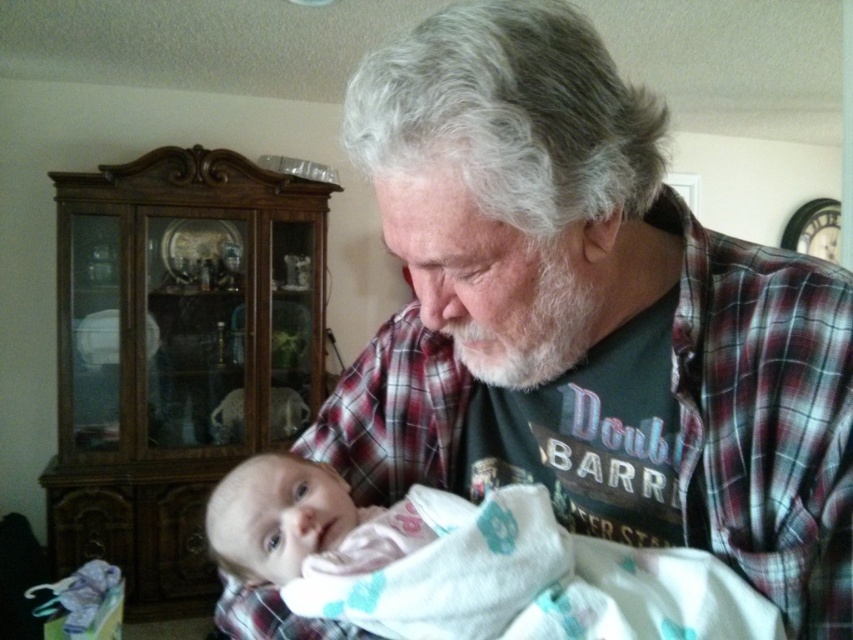
Question: Considering the relative positions of plaid flannel shirt at center and white soft swaddling blanket at center in the image provided, where is plaid flannel shirt at center located with respect to white soft swaddling blanket at center?

Choices:
 (A) left
 (B) right

Answer: (B)

Question: Which of the following is the closest to the observer?

Choices:
 (A) (498, 552)
 (B) (428, 323)

Answer: (A)

Question: Where is plaid flannel shirt at center located in relation to white soft swaddling blanket at center in the image?

Choices:
 (A) left
 (B) right

Answer: (B)

Question: Can you confirm if plaid flannel shirt at center is positioned to the right of white soft swaddling blanket at center?

Choices:
 (A) no
 (B) yes

Answer: (B)